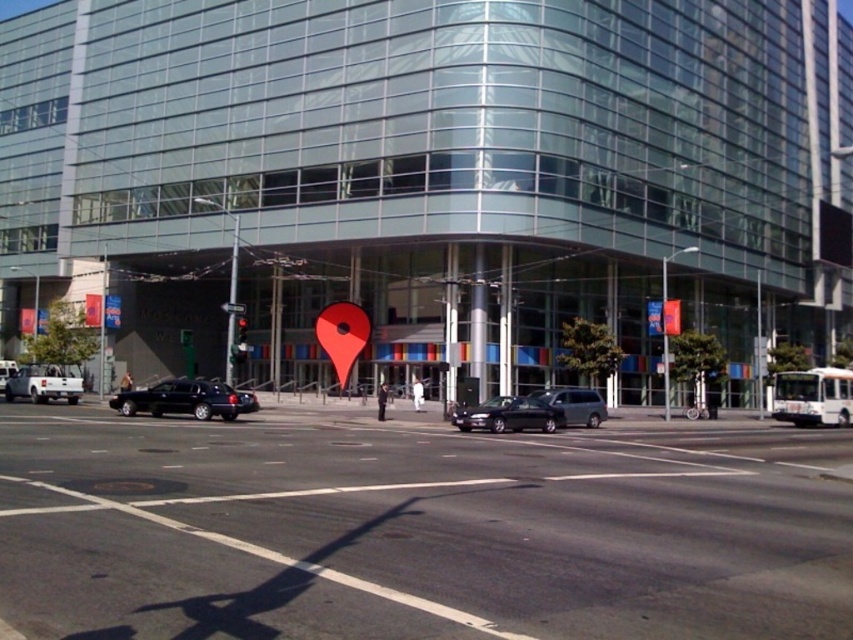
Question: From the image, what is the correct spatial relationship of black asphalt at center in relation to white matte truck at lower left?

Choices:
 (A) left
 (B) right

Answer: (B)

Question: Which of the following is the closest to the observer?

Choices:
 (A) black asphalt at center
 (B) white matte truck at lower left

Answer: (A)

Question: Does black asphalt at center appear over white matte truck at lower left?

Choices:
 (A) no
 (B) yes

Answer: (B)

Question: Based on their relative distances, which object is nearer to the black asphalt at center?

Choices:
 (A) shiny black sedan at center-left
 (B) red glass traffic light at center
 (C) shiny black sedan at center
 (D) metallic reflective traffic sign at center

Answer: (C)

Question: Which point is closer to the camera?

Choices:
 (A) coord(514,416)
 (B) coord(229,307)

Answer: (A)

Question: Is black asphalt at center closer to the viewer compared to metallic silver traffic sign at center?

Choices:
 (A) yes
 (B) no

Answer: (A)